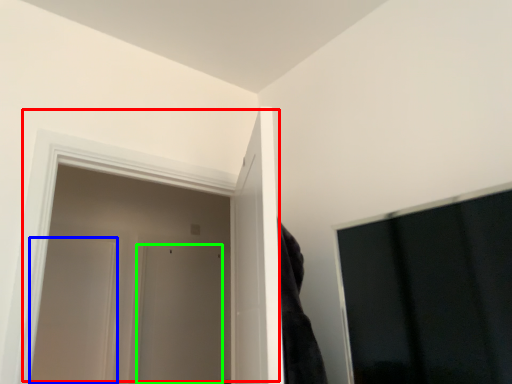
Question: Estimate the real-world distances between objects in this image. Which object is farther from door (highlighted by a red box), door (highlighted by a blue box) or door (highlighted by a green box)?

Choices:
 (A) door
 (B) door

Answer: (B)